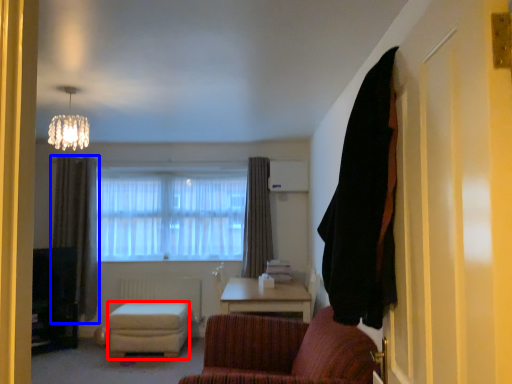
Question: Which of the following is the farthest to the observer, stool (highlighted by a red box) or curtain (highlighted by a blue box)?

Choices:
 (A) stool
 (B) curtain

Answer: (B)